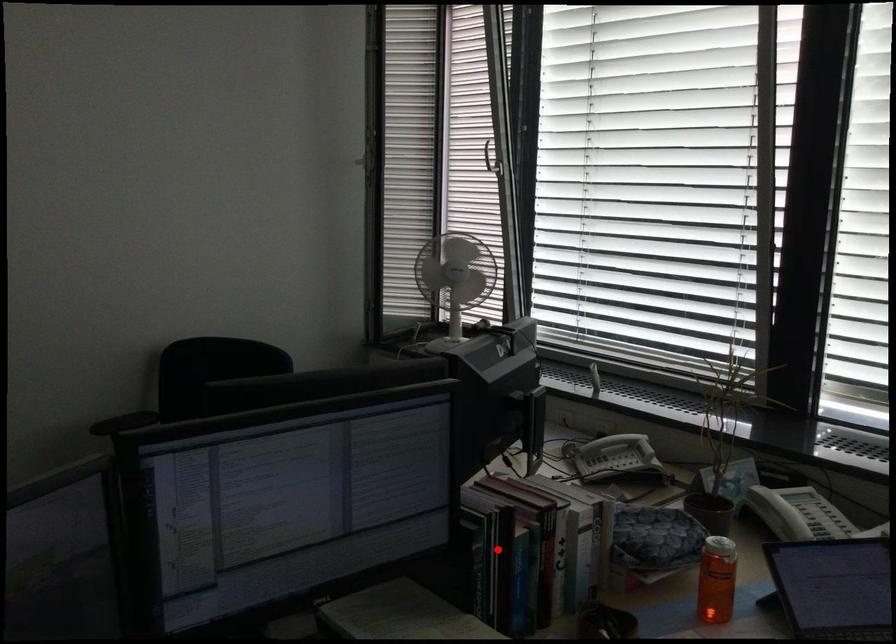
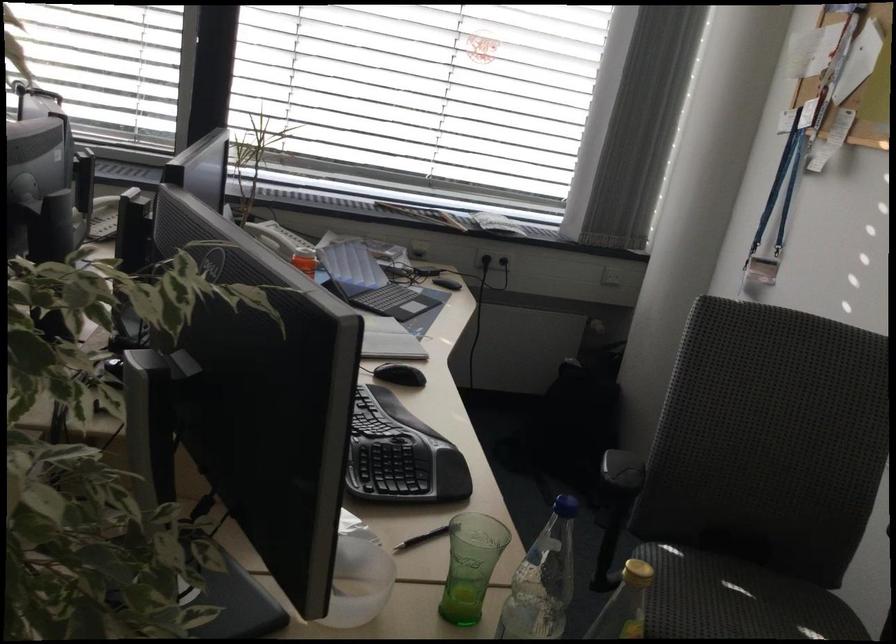
Question: I am providing you with two images of the same scene from different viewpoints. A red point is marked on the first image. Can you still see the location of the red point in image 2?

Choices:
 (A) Yes
 (B) No

Answer: (B)